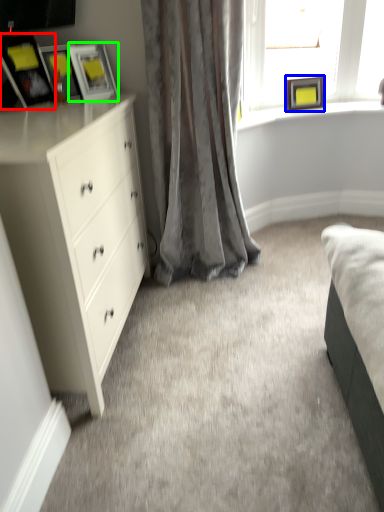
Question: Estimate the real-world distances between objects in this image. Which object is farther from picture frame (highlighted by a red box), picture frame (highlighted by a blue box) or picture frame (highlighted by a green box)?

Choices:
 (A) picture frame
 (B) picture frame

Answer: (A)